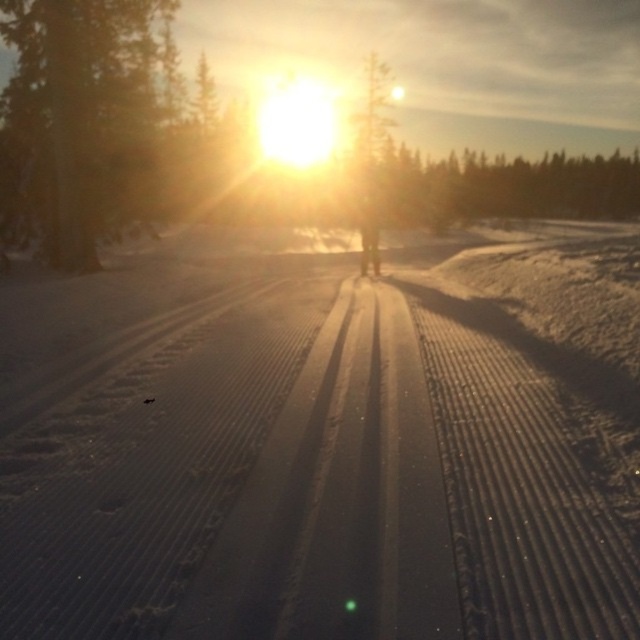
Question: Which of the following is the closest to the observer?

Choices:
 (A) (268, 330)
 (B) (360, 205)
 (C) (93, 17)

Answer: (A)

Question: From the image, what is the correct spatial relationship of white textured snow at center in relation to green textured tree at center?

Choices:
 (A) left
 (B) right

Answer: (A)

Question: Does white textured snow at center appear over green matte tree at upper center?

Choices:
 (A) yes
 (B) no

Answer: (B)

Question: Estimate the real-world distances between objects in this image. Which object is farther from the white textured snow at center?

Choices:
 (A) green textured tree at center
 (B) green matte tree at upper center

Answer: (B)

Question: Is white textured snow at center below green textured tree at upper left?

Choices:
 (A) no
 (B) yes

Answer: (B)

Question: Among these points, which one is nearest to the camera?

Choices:
 (A) (368, 563)
 (B) (387, 180)
 (C) (356, 173)

Answer: (A)